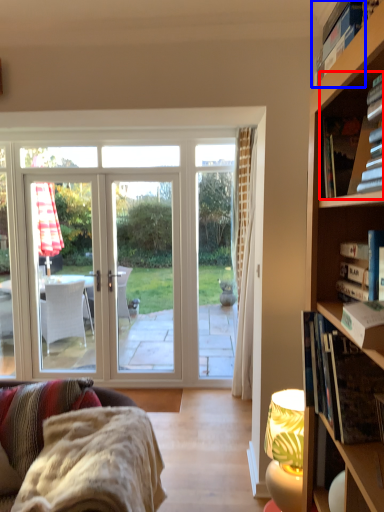
Question: Which object is closer to the camera taking this photo, book (highlighted by a red box) or book (highlighted by a blue box)?

Choices:
 (A) book
 (B) book

Answer: (B)